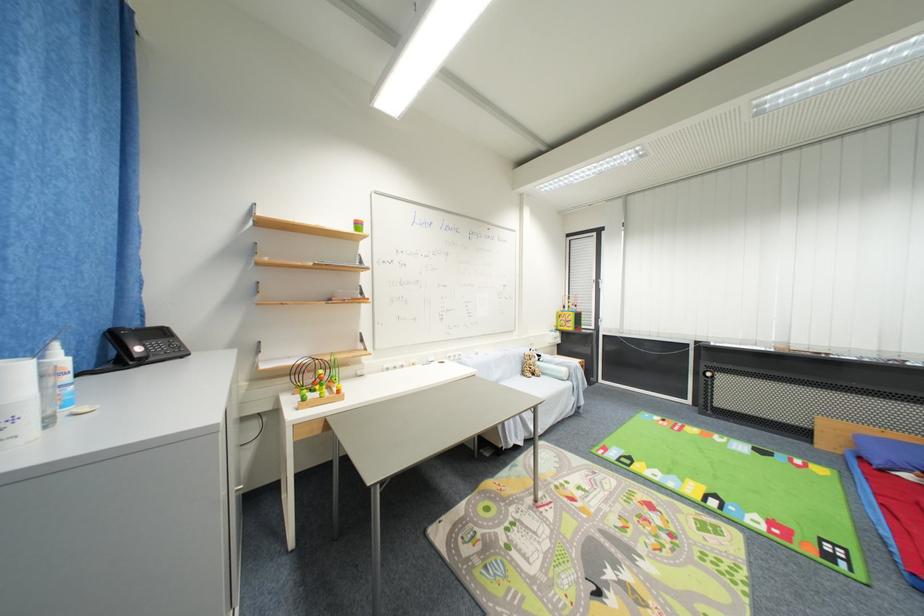
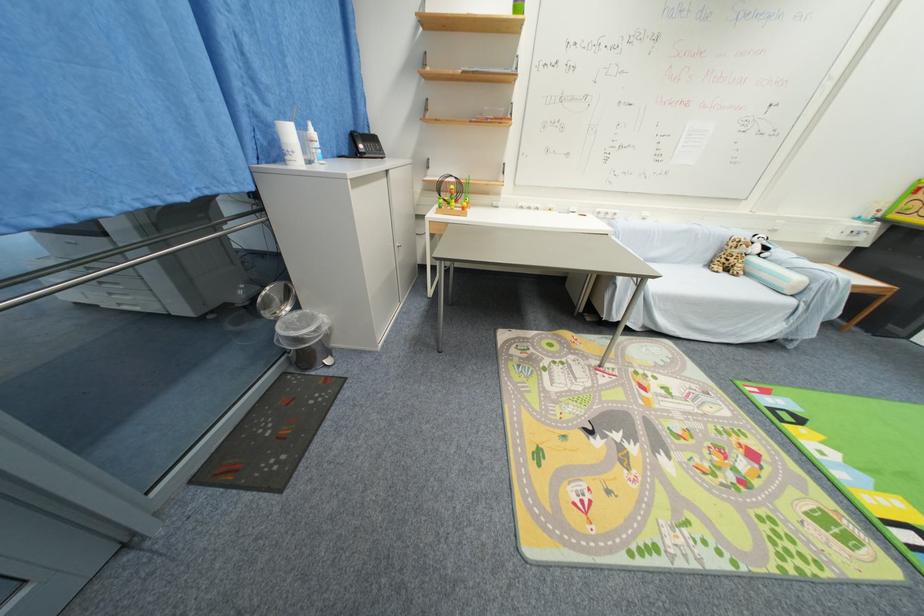
The point at (540,379) is marked in the first image. Where is the corresponding point in the second image?

(730, 276)